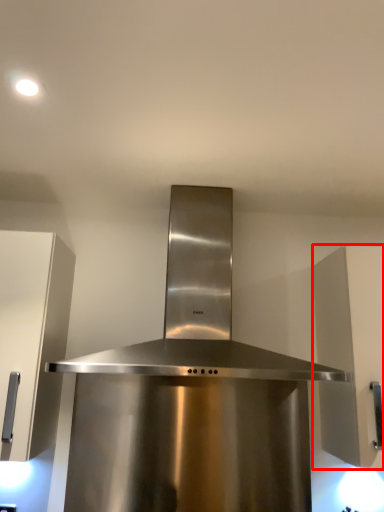
Question: From the image's perspective, what is the correct spatial positioning of cabinetry (annotated by the red box) in reference to home appliance?

Choices:
 (A) below
 (B) above

Answer: (A)